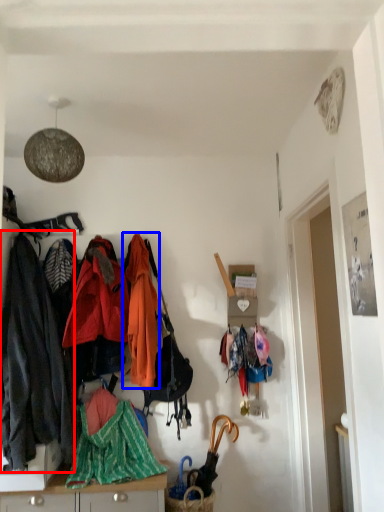
Question: Which object appears closest to the camera in this image, jacket (highlighted by a red box) or jacket (highlighted by a blue box)?

Choices:
 (A) jacket
 (B) jacket

Answer: (A)